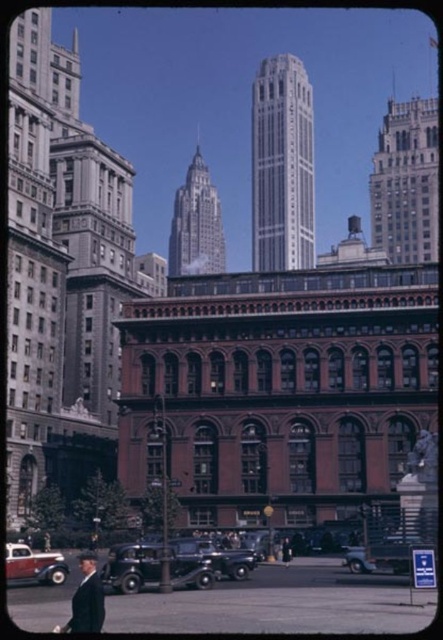
You are a pedestrian standing on the sidewalk and want to take a photo of the silver metallic skyscraper at center and the shiny black car at center. Which one should you point your camera upwards to capture?

You should point your camera upwards to capture the silver metallic skyscraper at center because it is located above the shiny black car at center.

You are standing at the point marked by point [195,225]. What is the direction of the silver metallic skyscraper at center relative to your position?

The silver metallic skyscraper at center is directly in front of you at point [195,225].